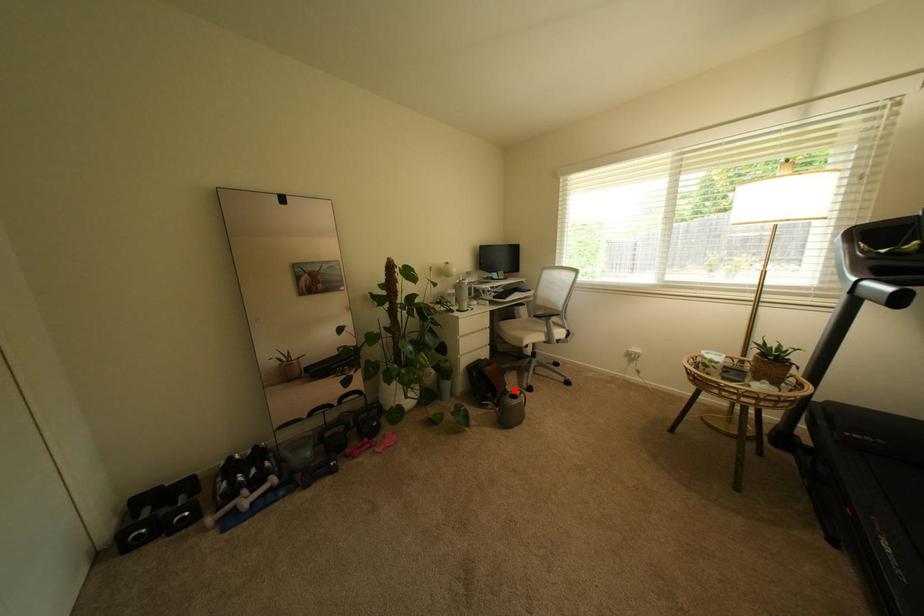
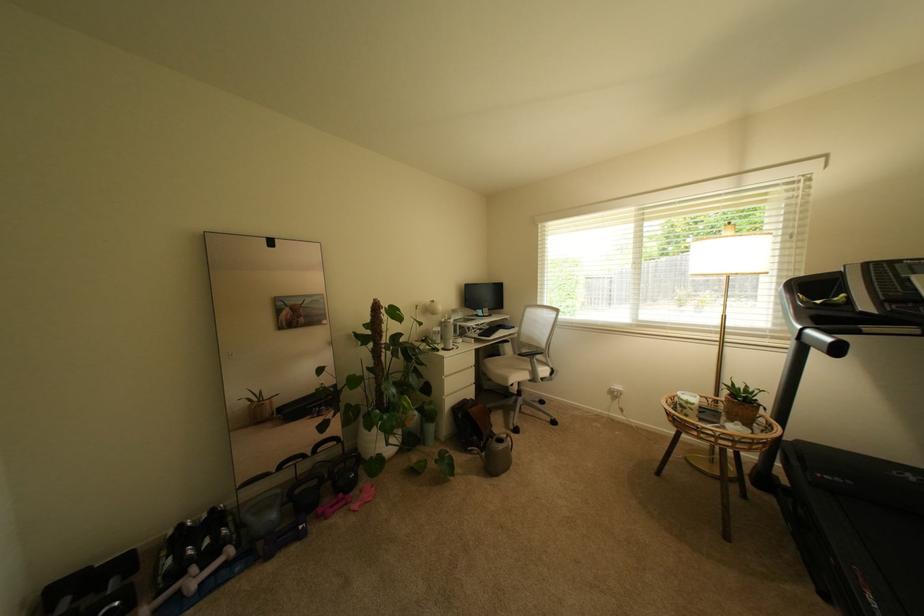
Where in the second image is the point corresponding to the highlighted location from the first image?

(500, 432)